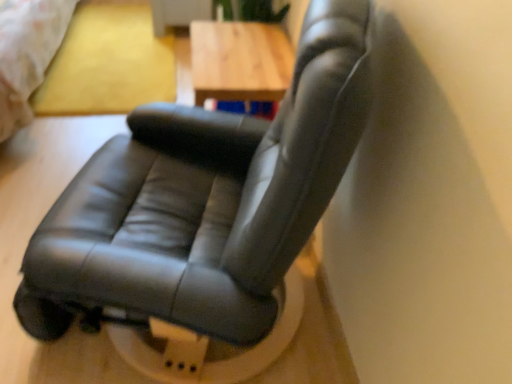
At what (x,y) coordinates should I click in order to perform the action: click on wooden table at center. Please return your answer as a coordinate pair (x, y). Looking at the image, I should click on (241, 63).

Identify the location of black leather chair at center. This screenshot has height=384, width=512. (205, 201).

Which of these two, matte yellow bed at upper left or black leather chair at center, stands shorter?

black leather chair at center is shorter.

From the picture: Can you confirm if matte yellow bed at upper left is wider than black leather chair at center?

No.

In the scene shown: Does black leather chair at center lie in front of matte yellow bed at upper left?

Yes, the depth of black leather chair at center is less than that of matte yellow bed at upper left.

In the scene shown: Is black leather chair at center at the left side of matte yellow bed at upper left?

No.

Is matte yellow bed at upper left at the back of black leather chair at center?

No, matte yellow bed at upper left is not at the back of black leather chair at center.

Is wooden table at center oriented towards black leather chair at center?

Yes, wooden table at center is turned towards black leather chair at center.

From a real-world perspective, is wooden table at center on top of black leather chair at center?

Yes, from a real-world perspective, wooden table at center is above black leather chair at center.

Choose the correct answer: Is wooden table at center inside black leather chair at center or outside it?

wooden table at center is not inside black leather chair at center, it's outside.

Is the position of black leather chair at center more distant than that of wooden table at center?

No.

From a real-world perspective, is black leather chair at center on wooden table at center?

No, from a real-world perspective, black leather chair at center is not on top of wooden table at center.

Is black leather chair at center with wooden table at center?

No, black leather chair at center is not making contact with wooden table at center.

Which is behind, wooden table at center or matte yellow bed at upper left?

wooden table at center is behind.

From a real-world perspective, which is physically above, wooden table at center or matte yellow bed at upper left?

wooden table at center, from a real-world perspective.

Is point (234, 70) closer or farther from the camera than point (75, 1)?

Point (234, 70) is closer to the camera than point (75, 1).

Considering the relative sizes of wooden table at center and matte yellow bed at upper left in the image provided, is wooden table at center thinner than matte yellow bed at upper left?

Indeed, wooden table at center has a lesser width compared to matte yellow bed at upper left.

Who is taller, matte yellow bed at upper left or wooden table at center?

With more height is wooden table at center.

Considering the sizes of matte yellow bed at upper left and wooden table at center in the image, is matte yellow bed at upper left wider or thinner than wooden table at center?

Considering their sizes, matte yellow bed at upper left looks broader than wooden table at center.

In the image, there is a wooden table at center. Where is `bed above it (from the image's perspective)`? This screenshot has height=384, width=512. bed above it (from the image's perspective) is located at coordinates (27, 54).

Where is `chair below the matte yellow bed at upper left (from a real-world perspective)`? Image resolution: width=512 pixels, height=384 pixels. chair below the matte yellow bed at upper left (from a real-world perspective) is located at coordinates (205, 201).

Find the location of `chair located on the right of matte yellow bed at upper left`. chair located on the right of matte yellow bed at upper left is located at coordinates (205, 201).

Based on the photo, based on their spatial positions, is matte yellow bed at upper left or wooden table at center further from black leather chair at center?

matte yellow bed at upper left is positioned further to the anchor black leather chair at center.

Which object lies further to the anchor point matte yellow bed at upper left, wooden table at center or black leather chair at center?

black leather chair at center lies further to matte yellow bed at upper left than the other object.

Based on their spatial positions, is black leather chair at center or wooden table at center further from matte yellow bed at upper left?

black leather chair at center is positioned further to the anchor matte yellow bed at upper left.

From the image, which object appears to be farther from wooden table at center, black leather chair at center or matte yellow bed at upper left?

matte yellow bed at upper left is positioned further to the anchor wooden table at center.

Which object lies nearer to the anchor point wooden table at center, matte yellow bed at upper left or black leather chair at center?

black leather chair at center is positioned closer to the anchor wooden table at center.

When comparing their distances from black leather chair at center, does wooden table at center or matte yellow bed at upper left seem closer?

Based on the image, wooden table at center appears to be nearer to black leather chair at center.

I want to click on chair situated between matte yellow bed at upper left and wooden table at center from left to right, so click(205, 201).